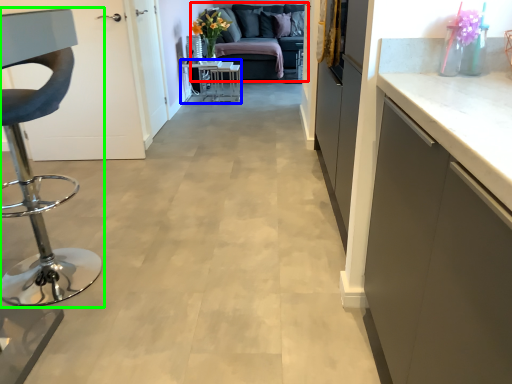
Question: Based on their relative distances, which object is farther from studio couch (highlighted by a red box)? Choose from table (highlighted by a blue box) and furniture (highlighted by a green box).

Choices:
 (A) table
 (B) furniture

Answer: (B)